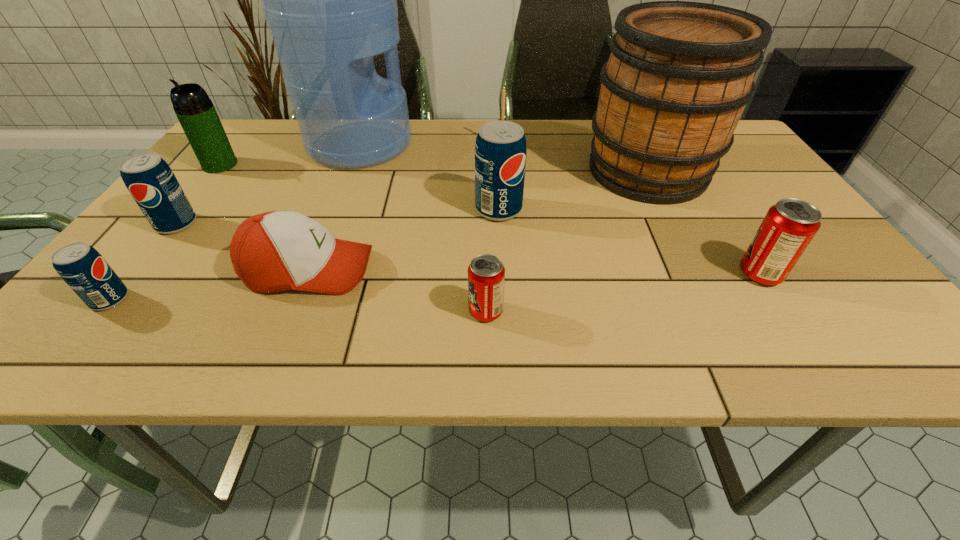
Image resolution: width=960 pixels, height=540 pixels. In order to click on water jug in this screenshot , I will do `click(330, 0)`.

In order to click on the tallest object in this screenshot , I will do `click(330, 0)`.

The height and width of the screenshot is (540, 960). Find the location of `cider`. cider is located at coordinates (680, 73).

The height and width of the screenshot is (540, 960). Identify the location of the third tallest object. (195, 111).

Where is `green thermos bottle`? green thermos bottle is located at coordinates (195, 111).

Identify the location of the tallest soda can. click(x=500, y=151).

What are the coordinates of `the rightmost blue pop` in the screenshot? It's located at (500, 151).

This screenshot has width=960, height=540. What are the coordinates of `candle_holder` in the screenshot? It's located at (503, 91).

At what (x,y) coordinates should I click in order to perform the action: click on the second smallest blue pop. Please return your answer as a coordinate pair (x, y). The width and height of the screenshot is (960, 540). Looking at the image, I should click on (149, 179).

What are the coordinates of `the right red soda can` in the screenshot? It's located at click(x=789, y=226).